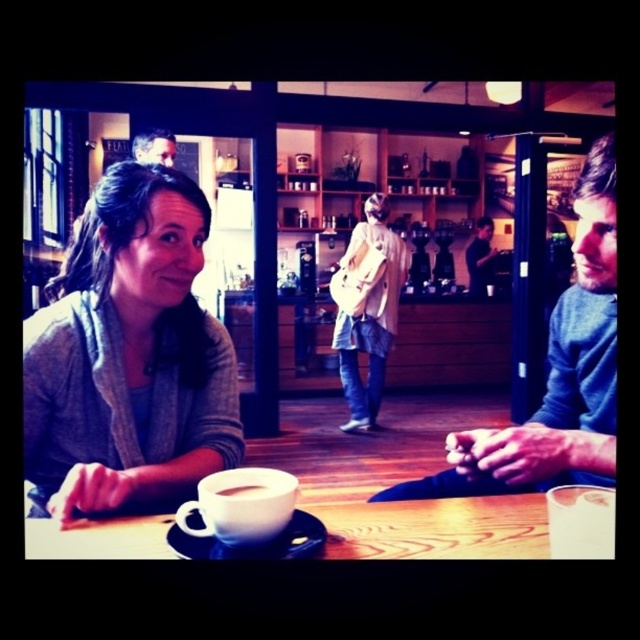
Is denim jacket at center further to the viewer compared to dark blue sweater at right?

No, denim jacket at center is closer to the viewer.

Does denim jacket at center have a lesser height compared to dark blue sweater at right?

No.

Between point (362, 259) and point (486, 237), which one is positioned in front?

Positioned in front is point (362, 259).

Where is `denim jacket at center`? The width and height of the screenshot is (640, 640). denim jacket at center is located at coordinates (368, 308).

Does white matte cup at lower center have a smaller size compared to white matte mug at center?

No, white matte cup at lower center is not smaller than white matte mug at center.

Is white matte cup at lower center closer to the viewer compared to white matte mug at center?

That is True.

Describe the element at coordinates (580, 522) in the screenshot. I see `white matte cup at lower center` at that location.

Locate an element on the screen. This screenshot has height=640, width=640. white matte cup at lower center is located at coordinates (580, 522).

Is white ceramic mug at center shorter than dark blue sweater at right?

Yes, white ceramic mug at center is shorter than dark blue sweater at right.

Is white ceramic mug at center wider than dark blue sweater at right?

In fact, white ceramic mug at center might be narrower than dark blue sweater at right.

This screenshot has height=640, width=640. Describe the element at coordinates (241, 506) in the screenshot. I see `white ceramic mug at center` at that location.

Where is `white ceramic mug at center`? The width and height of the screenshot is (640, 640). white ceramic mug at center is located at coordinates (241, 506).